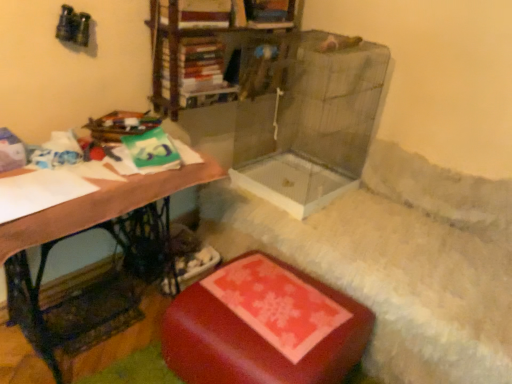
Question: Considering their positions, is hardcover book at upper center located in front of or behind wooden desk at left?

Choices:
 (A) behind
 (B) front

Answer: (A)

Question: Visually, is hardcover book at upper center positioned to the left or to the right of wooden desk at left?

Choices:
 (A) left
 (B) right

Answer: (B)

Question: Which of these objects is positioned closest to the hardcover book at upper center?

Choices:
 (A) wooden desk at left
 (B) metallic bookshelf at upper center
 (C) rubberized red ottoman at lower center

Answer: (B)

Question: Estimate the real-world distances between objects in this image. Which object is farther from the wooden desk at left?

Choices:
 (A) metallic bookshelf at upper center
 (B) rubberized red ottoman at lower center
 (C) hardcover book at upper center

Answer: (A)